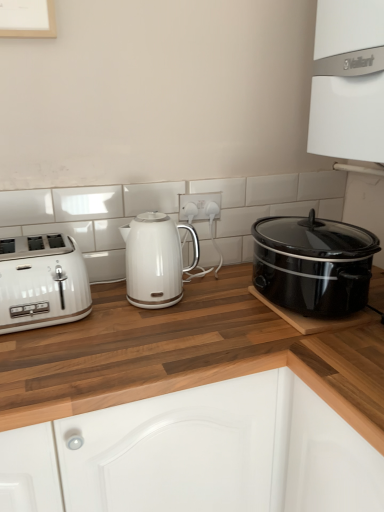
Identify the location of vacant area located to the right-hand side of white glossy kettle at center. This screenshot has height=512, width=384. (217, 308).